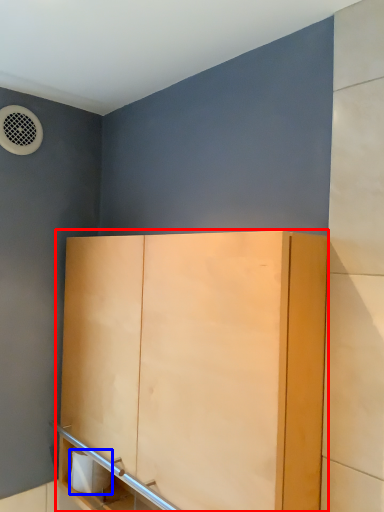
Question: Which object appears farthest to the camera in this image, cupboard (highlighted by a red box) or toilet paper (highlighted by a blue box)?

Choices:
 (A) cupboard
 (B) toilet paper

Answer: (B)